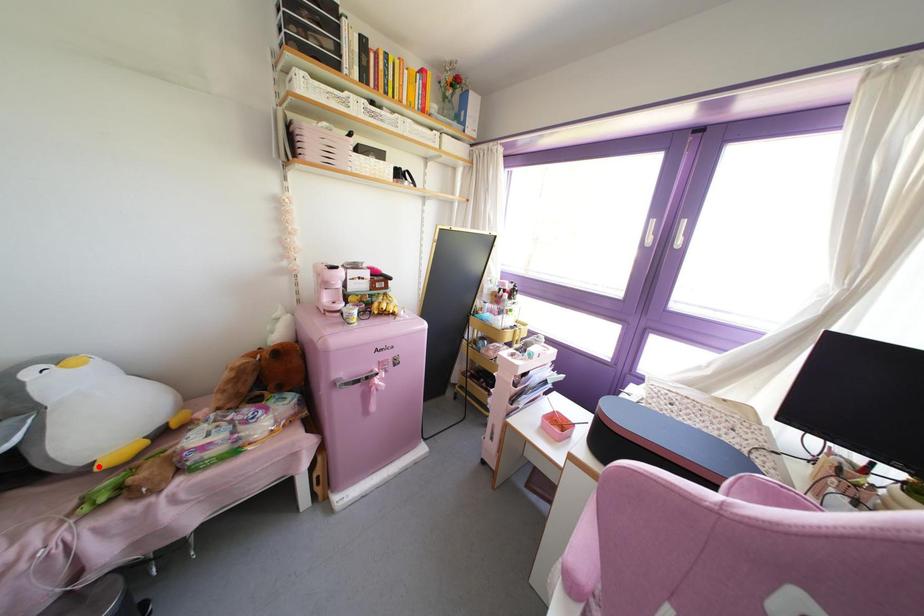
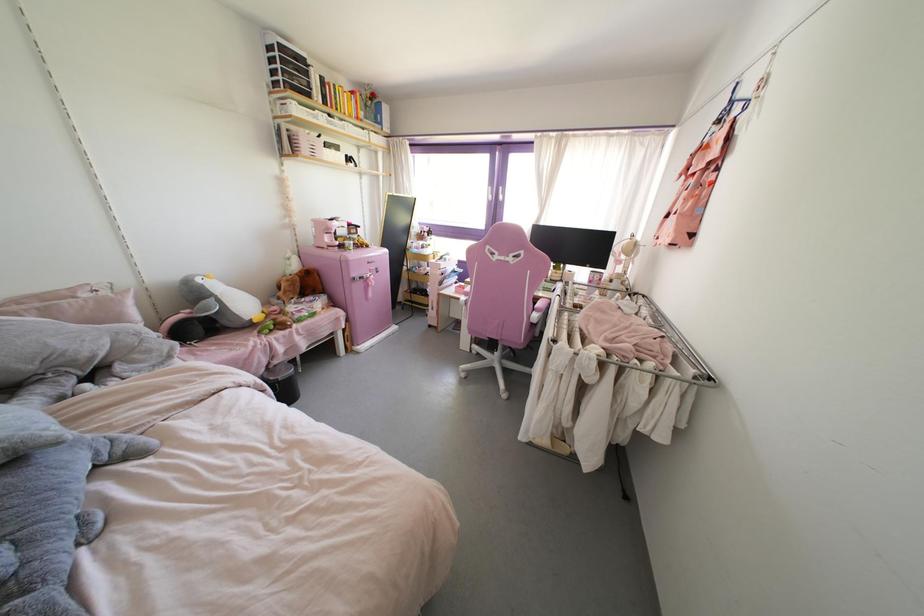
Find the pixel in the second image that matches the highlighted location in the first image.

(254, 320)